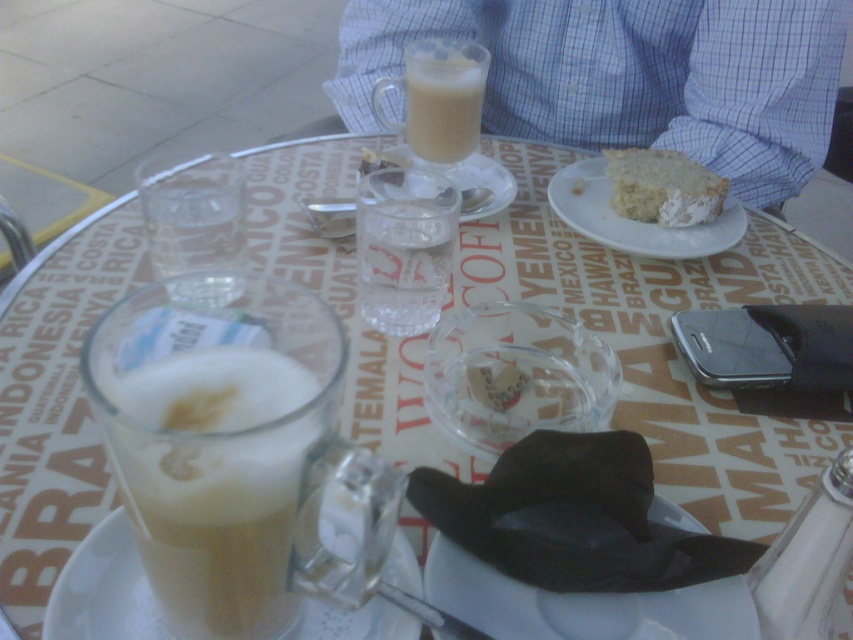
Question: Which point is farther to the camera?

Choices:
 (A) [x=444, y=42]
 (B) [x=514, y=580]
 (C) [x=838, y=556]
 (D) [x=705, y=214]

Answer: (A)

Question: Observing the image, what is the correct spatial positioning of white matte plate at center in reference to transparent glass ashtray at center?

Choices:
 (A) above
 (B) below

Answer: (B)

Question: Which point is closer to the camera taking this photo?

Choices:
 (A) (509, 177)
 (B) (660, 216)
 (C) (671, 253)
 (D) (424, 572)

Answer: (D)

Question: Does transparent glass bottle at lower right have a larger size compared to white crumbly cake at upper right?

Choices:
 (A) yes
 (B) no

Answer: (B)

Question: Considering the relative positions of white ceramic saucer at center and transparent glass ashtray at center in the image provided, where is white ceramic saucer at center located with respect to transparent glass ashtray at center?

Choices:
 (A) left
 (B) right

Answer: (A)

Question: Which of the following is the farthest from the observer?

Choices:
 (A) 410,566
 (B) 418,323
 (C) 741,221

Answer: (C)